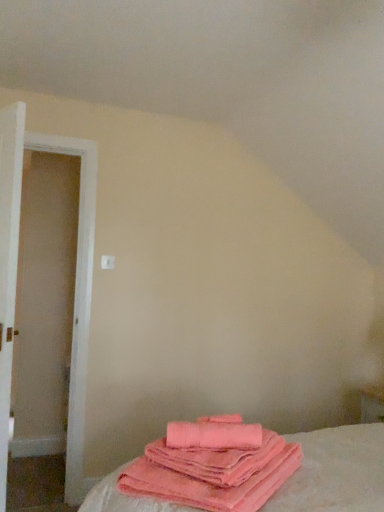
Find the location of a particular element. The height and width of the screenshot is (512, 384). pink soft cotton towels at lower center is located at coordinates (214, 434).

Measure the distance between point (x=73, y=425) and camera.

Point (x=73, y=425) is 7.85 feet away from camera.

This screenshot has height=512, width=384. Identify the location of pink soft cotton towels at lower center. (214, 434).

Locate an element on the screen. Image resolution: width=384 pixels, height=512 pixels. bed on the right of pink soft cotton towels at lower center is located at coordinates (335, 472).

Is point (224, 448) in front of point (324, 481)?

No, (224, 448) is behind (324, 481).

Does pink soft cotton towels at lower center turn towards pink plush towels at lower center?

No.

Relative to pink plush towels at lower center, is pink soft cotton towels at lower center in front or behind?

pink soft cotton towels at lower center is positioned farther from the viewer than pink plush towels at lower center.

Is pink plush towels at lower center directly adjacent to pink soft cotton towels at lower center?

There is a gap between pink plush towels at lower center and pink soft cotton towels at lower center.

From the picture: Can you tell me how much pink plush towels at lower center and pink soft cotton towels at lower center differ in facing direction?

They differ by 35.2 degrees in their facing directions.

From their relative heights in the image, would you say pink plush towels at lower center is taller or shorter than pink soft cotton towels at lower center?

Clearly, pink plush towels at lower center is taller compared to pink soft cotton towels at lower center.

Which is closer to the camera, (x=383, y=477) or (x=250, y=434)?

Clearly, point (x=383, y=477) is closer to the camera than point (x=250, y=434).

From the picture: Which object is positioned more to the right, pink plush towels at lower center or white wooden door at left?

Positioned to the right is pink plush towels at lower center.

Considering the positions of point (114, 494) and point (77, 420), is point (114, 494) closer or farther from the camera than point (77, 420)?

Clearly, point (114, 494) is closer to the camera than point (77, 420).

From their relative heights in the image, would you say pink plush towels at lower center is taller or shorter than white wooden door at left?

Clearly, pink plush towels at lower center is shorter compared to white wooden door at left.

Are white wooden door at left and pink plush towels at lower center beside each other?

No, white wooden door at left is not with pink plush towels at lower center.

Who is smaller, white wooden door at left or pink plush towels at lower center?

pink plush towels at lower center is smaller.

Is pink plush towels at lower center completely or partially inside white wooden door at left?

No, white wooden door at left does not contain pink plush towels at lower center.

Consider the image. From the image's perspective, is white wooden door at left on top of pink plush towels at lower center?

Indeed, from the image's perspective, white wooden door at left is shown above pink plush towels at lower center.

Where is `door that appears behind the pink soft cotton towels at lower center`? door that appears behind the pink soft cotton towels at lower center is located at coordinates (77, 300).

Is point (226, 430) behind point (78, 313)?

No.

Considering the sizes of objects pink soft cotton towels at lower center and white wooden door at left in the image provided, who is smaller, pink soft cotton towels at lower center or white wooden door at left?

pink soft cotton towels at lower center.

Based on the photo, from a real-world perspective, is pink soft cotton towels at lower center under white wooden door at left?

Yes.

Consider the image. Which is in front, white wooden door at left or pink soft cotton towels at lower center?

pink soft cotton towels at lower center.

Consider the image. Which object is thinner, white wooden door at left or pink soft cotton towels at lower center?

Thinner between the two is white wooden door at left.

From the image's perspective, is white wooden door at left positioned above or below pink soft cotton towels at lower center?

Clearly, from the image's perspective, white wooden door at left is above pink soft cotton towels at lower center.

Locate an element on the screen. The height and width of the screenshot is (512, 384). beach towel below the white wooden door at left (from the image's perspective) is located at coordinates (214, 434).

At what (x,y) coordinates should I click in order to perform the action: click on bed in front of the pink soft cotton towels at lower center. Please return your answer as a coordinate pair (x, y). Looking at the image, I should click on (335, 472).

Identify the location of bed that appears on the right of pink soft cotton towels at lower center. (335, 472).

Based on their spatial positions, is pink soft cotton towels at lower center or white wooden door at left closer to pink plush towels at lower center?

pink soft cotton towels at lower center lies closer to pink plush towels at lower center than the other object.

Based on their spatial positions, is white wooden door at left or pink soft cotton towels at lower center closer to pink plush towels at lower center?

pink soft cotton towels at lower center is positioned closer to the anchor pink plush towels at lower center.

Based on their spatial positions, is pink soft cotton towels at lower center or pink plush towels at lower center closer to white wooden door at left?

Among the two, pink soft cotton towels at lower center is located nearer to white wooden door at left.

Which object lies further to the anchor point pink soft cotton towels at lower center, white wooden door at left or pink plush towels at lower center?

The object further to pink soft cotton towels at lower center is white wooden door at left.

When comparing their distances from white wooden door at left, does pink plush towels at lower center or pink soft cotton towels at lower center seem closer?

Based on the image, pink soft cotton towels at lower center appears to be nearer to white wooden door at left.

Which object lies further to the anchor point pink soft cotton towels at lower center, pink plush towels at lower center or white wooden door at left?

white wooden door at left lies further to pink soft cotton towels at lower center than the other object.

Where is `beach towel between pink plush towels at lower center and white wooden door at left from front to back`? The width and height of the screenshot is (384, 512). beach towel between pink plush towels at lower center and white wooden door at left from front to back is located at coordinates (214, 434).